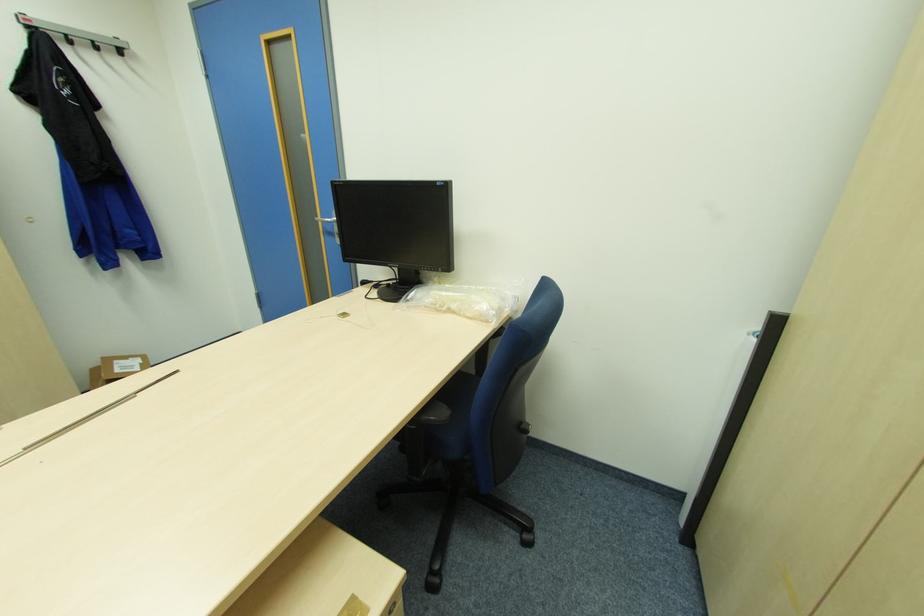
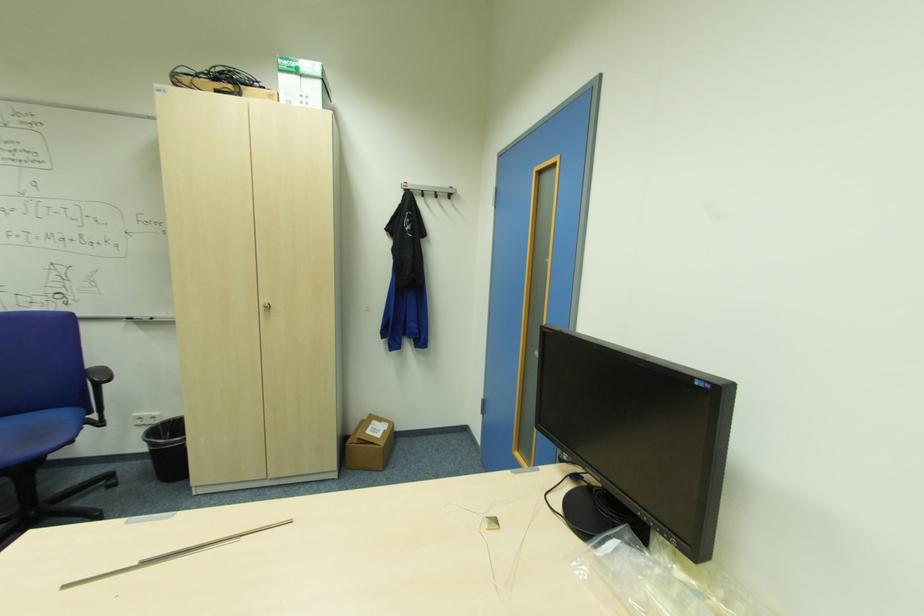
The point at [120,370] is marked in the first image. Where is the corresponding point in the second image?

(371, 431)